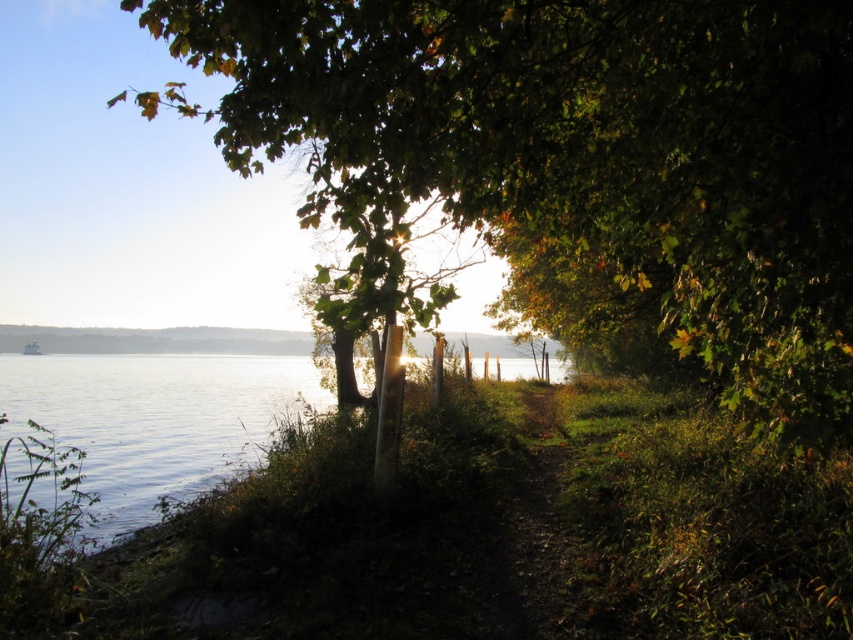
You are standing on the dirt path at the lakeside and looking towards the wooden fence. There is a point marked at coordinates point (589, 150). What object is located at that point?

The point (589, 150) marks a green leafy tree at center.

You are standing on the dirt path and want to walk towards the clear water at lower left. Which direction should you turn to avoid the green leafy tree at center?

Since the green leafy tree at center is to the right of clear water at lower left, you should turn left to walk towards the clear water at lower left and avoid the tree.

You are standing on the dirt path and want to know which object is higher between the green leafy tree at center and the clear water at lower left. Can you tell me?

The green leafy tree at center is taller than the clear water at lower left.